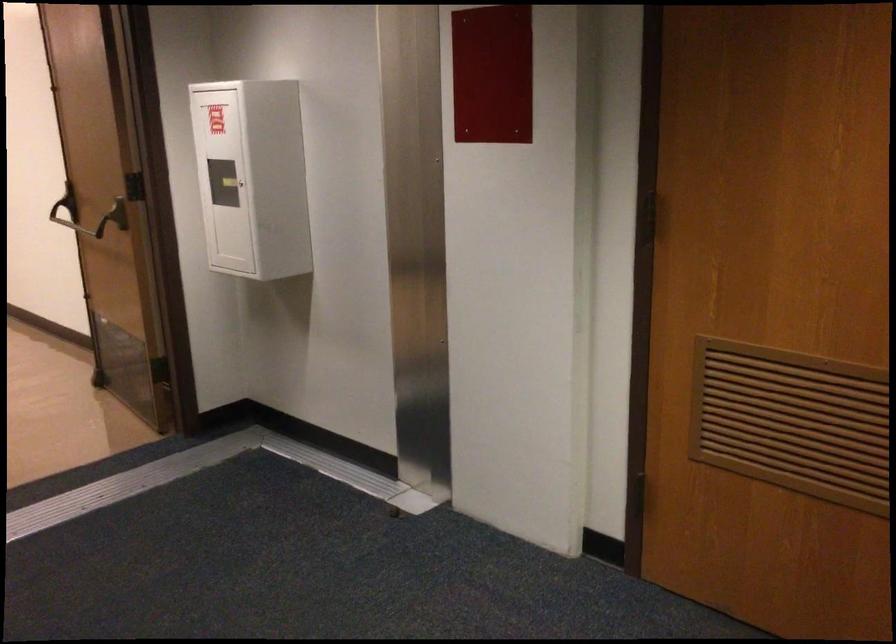
Question: The camera is either moving clockwise (left) or counter-clockwise (right) around the object. The first image is from the beginning of the video and the second image is from the end. Is the camera moving left or right when shooting the video?

Choices:
 (A) Left
 (B) Right

Answer: (B)